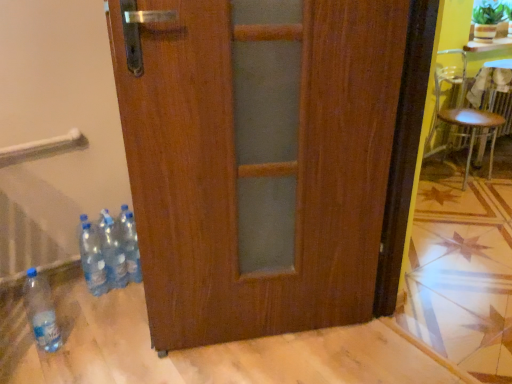
Question: From a real-world perspective, is metallic silver chair at right above or below green leafy plant at upper right?

Choices:
 (A) below
 (B) above

Answer: (A)

Question: In terms of height, does metallic silver chair at right look taller or shorter compared to green leafy plant at upper right?

Choices:
 (A) short
 (B) tall

Answer: (B)

Question: Estimate the real-world distances between objects in this image. Which object is closer to the translucent plastic bottles at lower left, the third bottle in the left-to-right sequence?

Choices:
 (A) blue plastic bottle at lower left, placed as the 1th bottle when sorted from right to left
 (B) transparent plastic bottle at lower left, which is the 1th bottle from left to right
 (C) green leafy plant at upper right
 (D) metallic silver chair at right
 (E) transparent plastic bottles at lower left, the 2th bottle positioned from the left

Answer: (A)

Question: Which object is the farthest from the translucent plastic bottles at lower left, the second bottle when ordered from right to left?

Choices:
 (A) green leafy plant at upper right
 (B) transparent plastic bottle at lower left, positioned as the fourth bottle in right-to-left order
 (C) transparent plastic bottles at lower left, marked as the third bottle in a right-to-left arrangement
 (D) blue plastic bottle at lower left, which is the 4th bottle from left to right
 (E) metallic silver chair at right

Answer: (A)